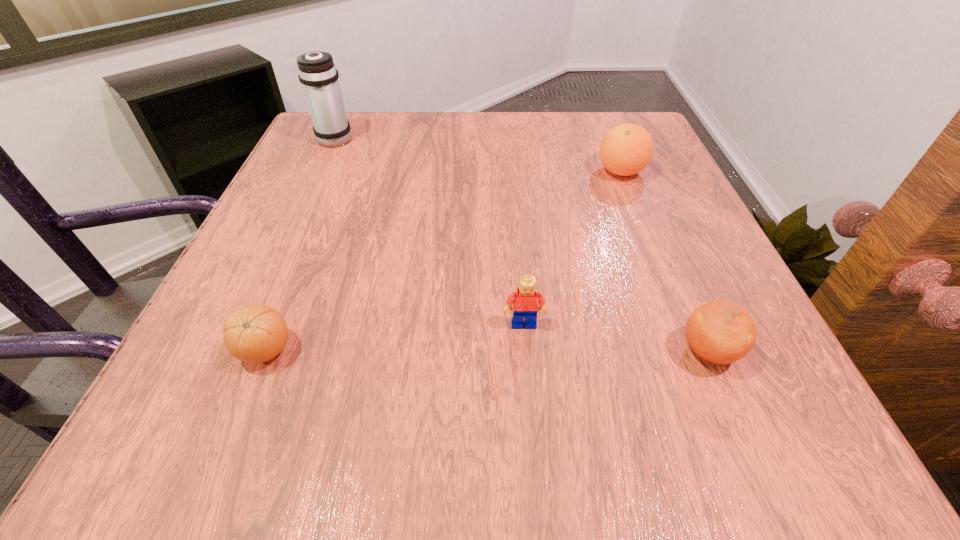
Where is `thermos bottle present at the far edge`? This screenshot has height=540, width=960. thermos bottle present at the far edge is located at coordinates (317, 73).

Find the location of a particular element. The image size is (960, 540). orange that is at the far edge is located at coordinates [x=626, y=149].

Image resolution: width=960 pixels, height=540 pixels. Find the location of `thermos bottle that is at the left edge`. thermos bottle that is at the left edge is located at coordinates (317, 73).

Locate an element on the screen. orange that is at the left edge is located at coordinates (256, 333).

Image resolution: width=960 pixels, height=540 pixels. What are the coordinates of `object that is at the far left corner` in the screenshot? It's located at (317, 73).

Locate an element on the screen. object that is at the far right corner is located at coordinates (626, 149).

Image resolution: width=960 pixels, height=540 pixels. I want to click on vacant region at the far edge of the desktop, so click(420, 139).

You are a GUI agent. You are given a task and a screenshot of the screen. Output one action in this format:
    pyautogui.click(x=<x>, y=<y>)
    Task: Click on the free region at the near edge of the desktop
    
    Given the screenshot: What is the action you would take?
    pyautogui.click(x=525, y=443)

Locate an element on the screen. free space at the left edge of the desktop is located at coordinates click(x=338, y=205).

Locate an element on the screen. vacant space at the right edge of the desktop is located at coordinates (645, 214).